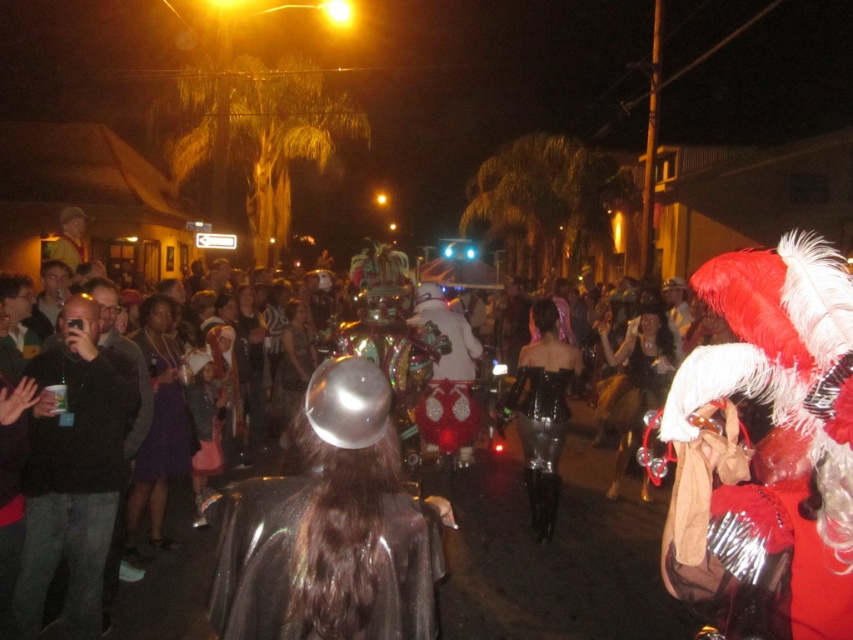
Is shiny metallic helmet at center below purple satin dress at center?

Incorrect, shiny metallic helmet at center is not positioned below purple satin dress at center.

Does point (375, 440) lie behind point (180, 422)?

No.

Is point (314, 520) positioned behind point (140, 474)?

No, it is in front of (140, 474).

Find the location of `shiny metallic helmet at center`. shiny metallic helmet at center is located at coordinates (329, 529).

Is shiny metallic costume at center to the right of shiny black dress at center from the viewer's perspective?

In fact, shiny metallic costume at center is to the left of shiny black dress at center.

Is point (700, 481) positioned in front of point (550, 365)?

Yes, it is in front of point (550, 365).

Does point (798, 236) come farther from viewer compared to point (563, 428)?

That is True.

The image size is (853, 640). What are the coordinates of `shiny metallic costume at center` in the screenshot? It's located at (769, 445).

Is white matte costume at center behind purple satin dress at center?

Yes, it is behind purple satin dress at center.

Who is higher up, white matte costume at center or purple satin dress at center?

purple satin dress at center is higher up.

Does point (471, 340) come closer to viewer compared to point (180, 456)?

No, (471, 340) is behind (180, 456).

Identify the location of white matte costume at center. This screenshot has height=640, width=853. (447, 380).